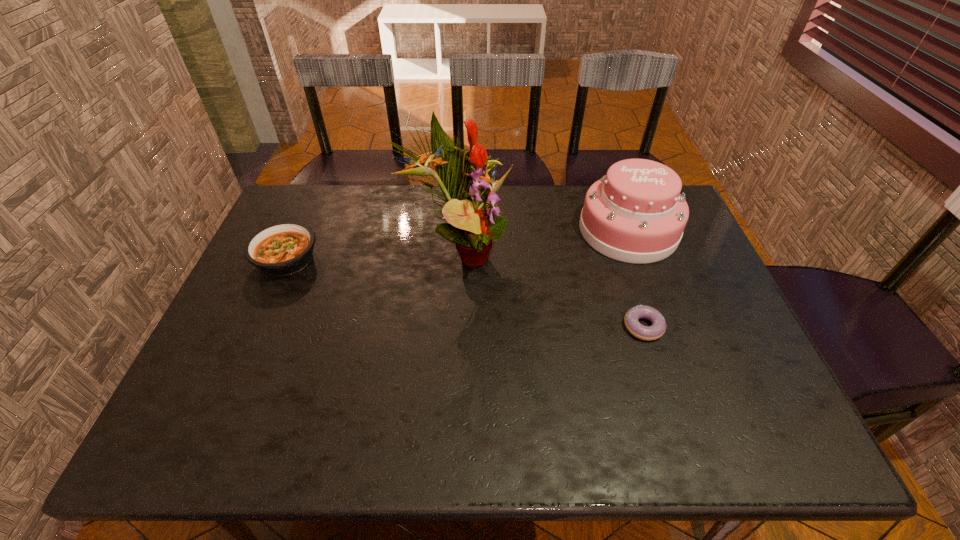
You are a GUI agent. You are given a task and a screenshot of the screen. Output one action in this format:
    pyautogui.click(x=<x>, y=<y>)
    Task: Click on the tallest object
    The height and width of the screenshot is (540, 960).
    Given the screenshot: What is the action you would take?
    pyautogui.click(x=474, y=218)

The image size is (960, 540). I want to click on bouquet, so click(474, 218).

Where is `cake`? cake is located at coordinates (635, 213).

This screenshot has width=960, height=540. What are the coordinates of `the third tallest object` in the screenshot? It's located at (281, 249).

Where is `stew`? stew is located at coordinates (281, 249).

The height and width of the screenshot is (540, 960). Find the location of `the shortest object`. the shortest object is located at coordinates click(631, 320).

You are a GUI agent. You are given a task and a screenshot of the screen. Output one action in this format:
    pyautogui.click(x=<x>, y=<y>)
    Task: Click on the doughnut
    The width and height of the screenshot is (960, 540).
    Given the screenshot: What is the action you would take?
    pyautogui.click(x=631, y=320)

What are the coordinates of `free space located 0.180m on the front-facing side of the bouquet` in the screenshot? It's located at (575, 252).

What are the coordinates of `free space located on the left of the cake` in the screenshot? It's located at (561, 231).

Locate an element on the screen. Image resolution: width=960 pixels, height=540 pixels. blank space located 0.130m on the back of the leftmost object is located at coordinates [x=308, y=212].